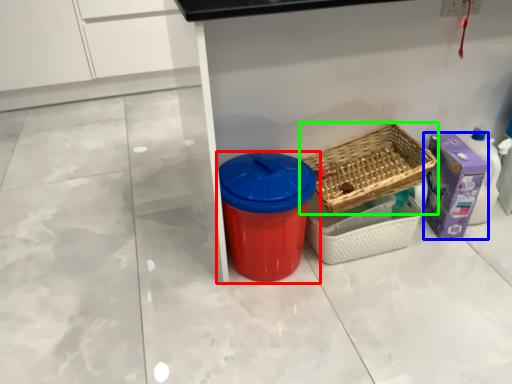
Question: Considering the real-world distances, which object is closest to waste container (highlighted by a red box)? storage box (highlighted by a blue box) or basket (highlighted by a green box).

Choices:
 (A) storage box
 (B) basket

Answer: (B)